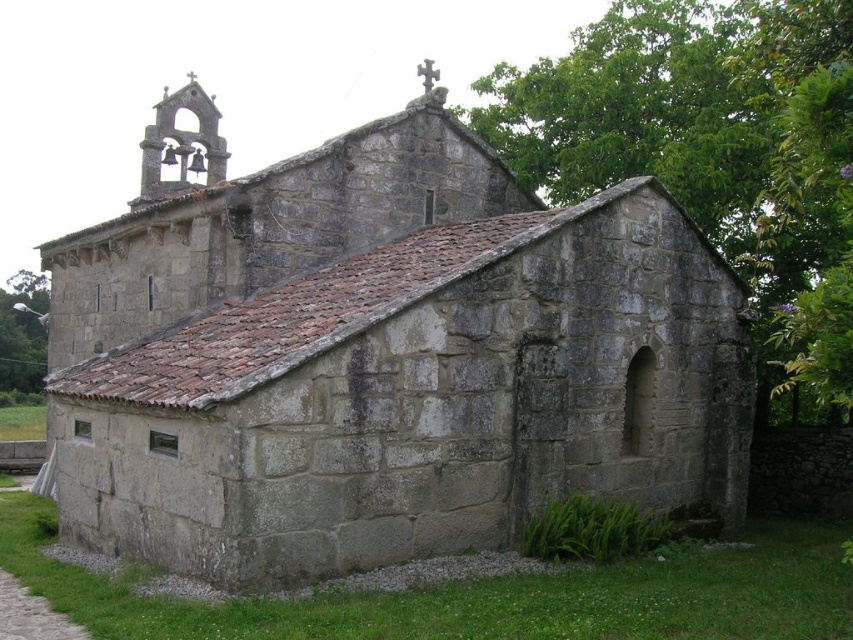
You are standing at the point marked by coordinates point (380, 355). Based on the scene described, what structure are you directly facing?

The point (380, 355) marks the gray stone church at center, so you are directly facing the gray stone church at center.

You are standing at the entrance of the church and notice both the gray cobblestone path at lower left and the green grass at lower left. Which surface is higher in elevation?

The gray cobblestone path at lower left has a greater height compared to the green grass at lower left, so the gray cobblestone path at lower left is higher in elevation.